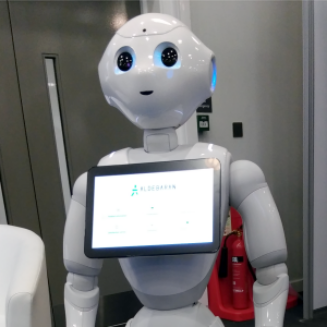
Find the location of a particular element. This screenshot has height=327, width=327. white chair is located at coordinates (18, 277).